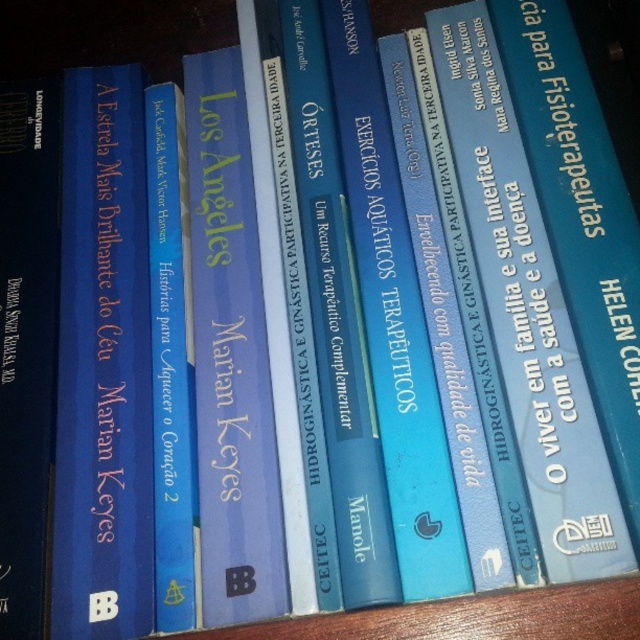
You are organizing books on a wooden surface and need to place a new book exactly where the matte blue book at center is currently located. According to the coordinates provided, where should you place the new book?

You should place the new book at point (230, 355) where the matte blue book at center is located.

You are organizing a bookshelf and see the blue hardcover book at left and the matte blue book at center. Which book is located to the right of the other?

The blue hardcover book at left is positioned on the left side of matte blue book at center, so the matte blue book at center is to the right of the blue hardcover book at left.